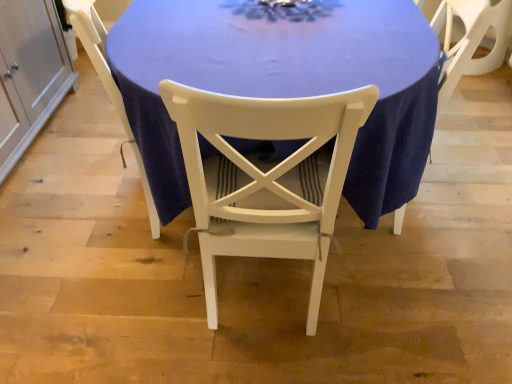
Question: Is there a large distance between blue fabric table at center and white wood chair at center, which ranks as the third chair in right-to-left order?

Choices:
 (A) yes
 (B) no

Answer: (B)

Question: Is the depth of blue fabric table at center greater than that of white wood chair at center, marked as the 1th chair in a left-to-right arrangement?

Choices:
 (A) yes
 (B) no

Answer: (B)

Question: Are blue fabric table at center and white wood chair at center, marked as the 1th chair in a left-to-right arrangement, beside each other?

Choices:
 (A) yes
 (B) no

Answer: (B)

Question: Considering the relative sizes of blue fabric table at center and white wood chair at center, which ranks as the third chair in right-to-left order, in the image provided, is blue fabric table at center thinner than white wood chair at center, which ranks as the third chair in right-to-left order,?

Choices:
 (A) yes
 (B) no

Answer: (B)

Question: Is blue fabric table at center located outside white wood chair at center, marked as the 1th chair in a left-to-right arrangement?

Choices:
 (A) yes
 (B) no

Answer: (A)

Question: Is blue fabric table at center surrounding white wood chair at center, which ranks as the third chair in right-to-left order?

Choices:
 (A) yes
 (B) no

Answer: (A)

Question: Is white wood chair at center, marked as the 3th chair in a left-to-right arrangement, not within blue fabric table at center?

Choices:
 (A) yes
 (B) no

Answer: (B)

Question: Can you confirm if white wood chair at center, marked as the 3th chair in a left-to-right arrangement, is thinner than blue fabric table at center?

Choices:
 (A) no
 (B) yes

Answer: (B)

Question: Is blue fabric table at center completely or partially inside white wood chair at center, marked as the 3th chair in a left-to-right arrangement?

Choices:
 (A) yes
 (B) no

Answer: (B)

Question: Is white wood chair at center, marked as the 3th chair in a left-to-right arrangement, facing away from blue fabric table at center?

Choices:
 (A) yes
 (B) no

Answer: (A)

Question: From the image's perspective, does white wood chair at center, the 1th chair positioned from the right, appear higher than blue fabric table at center?

Choices:
 (A) yes
 (B) no

Answer: (B)

Question: Is white wood chair at center, marked as the 3th chair in a left-to-right arrangement, not near blue fabric table at center?

Choices:
 (A) yes
 (B) no

Answer: (B)

Question: Is white painted wood chair at center, marked as the 2th chair in a left-to-right arrangement, oriented away from white wood chair at center, the 1th chair positioned from the right?

Choices:
 (A) yes
 (B) no

Answer: (B)